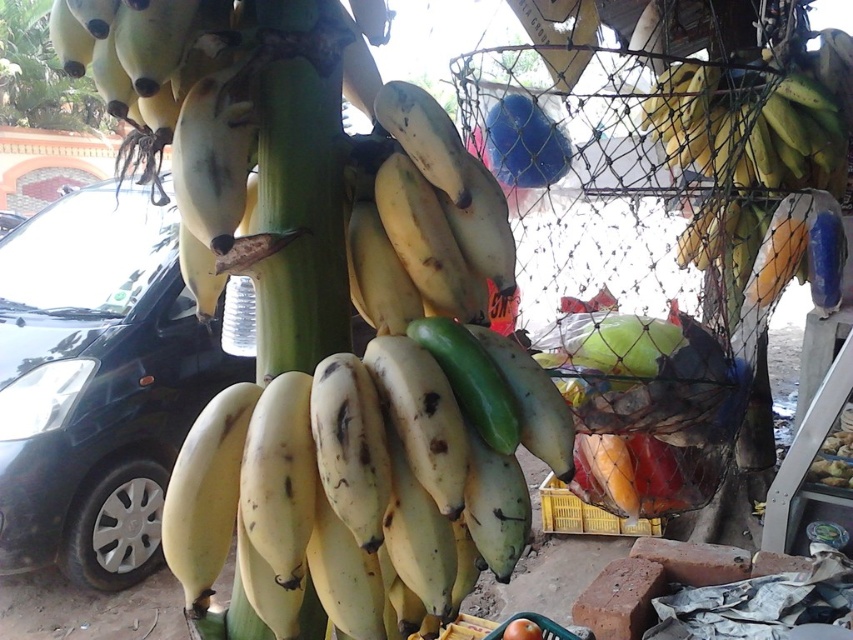
You are a delivery person trying to load a yellow matte bananas at center into a black metallic car at left. Can the bananas fit inside the car based on their size?

The yellow matte bananas at center has a width less than the black metallic car at left, so the bananas can fit inside the car.

You are a delivery person who needs to place a package between the yellow matte bananas at center and the black metallic car at left. The package requires a space of 7 feet. Is there enough space between them?

The distance between the yellow matte bananas at center and the black metallic car at left is 6.90 feet, which is slightly less than the required 7 feet. Therefore, there isn not enough space to place the package between them.

You are standing at the point labeled as point (376, 410) in the image. What object are you currently standing on?

The point (376, 410) is on yellow matte bananas at center.